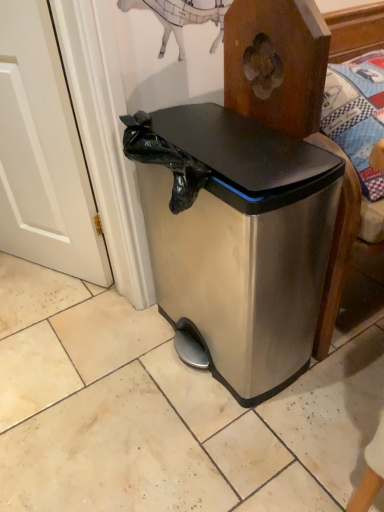
Question: Should I look upward or downward to see stainless steel trash can at center?

Choices:
 (A) down
 (B) up

Answer: (B)

Question: Considering the relative sizes of white wood door at left and stainless steel trash can at center in the image provided, is white wood door at left bigger than stainless steel trash can at center?

Choices:
 (A) yes
 (B) no

Answer: (B)

Question: Does white wood door at left appear on the right side of stainless steel trash can at center?

Choices:
 (A) yes
 (B) no

Answer: (B)

Question: Is white wood door at left positioned far away from stainless steel trash can at center?

Choices:
 (A) no
 (B) yes

Answer: (A)

Question: Is white wood door at left turned away from stainless steel trash can at center?

Choices:
 (A) yes
 (B) no

Answer: (B)

Question: Can we say white wood door at left lies outside stainless steel trash can at center?

Choices:
 (A) no
 (B) yes

Answer: (B)

Question: Does white wood door at left have a greater height compared to stainless steel trash can at center?

Choices:
 (A) no
 (B) yes

Answer: (B)

Question: Is stainless steel trash can at center smaller than white wood door at left?

Choices:
 (A) no
 (B) yes

Answer: (A)

Question: Does stainless steel trash can at center turn towards white wood door at left?

Choices:
 (A) no
 (B) yes

Answer: (A)

Question: Considering the relative sizes of stainless steel trash can at center and white wood door at left in the image provided, is stainless steel trash can at center thinner than white wood door at left?

Choices:
 (A) no
 (B) yes

Answer: (A)

Question: Does stainless steel trash can at center lie behind white wood door at left?

Choices:
 (A) yes
 (B) no

Answer: (B)

Question: Is stainless steel trash can at center at the right side of white wood door at left?

Choices:
 (A) no
 (B) yes

Answer: (B)

Question: From a real-world perspective, does stainless steel trash can at center stand above white wood door at left?

Choices:
 (A) yes
 (B) no

Answer: (B)

Question: Considering their positions, is white wood door at left located in front of or behind stainless steel trash can at center?

Choices:
 (A) front
 (B) behind

Answer: (B)